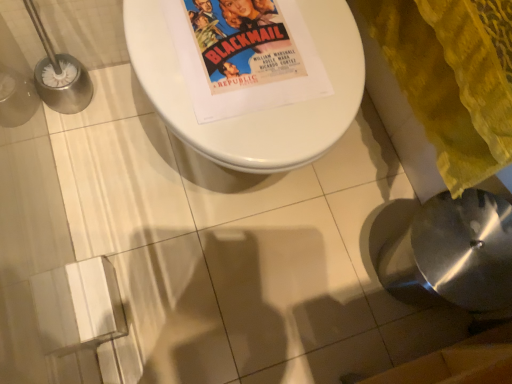
At what (x,y) coordinates should I click in order to perform the action: click on free region on the left part of satin silver sink at lower right. Please return your answer as a coordinate pair (x, y). This screenshot has width=512, height=384. Looking at the image, I should click on coord(303,242).